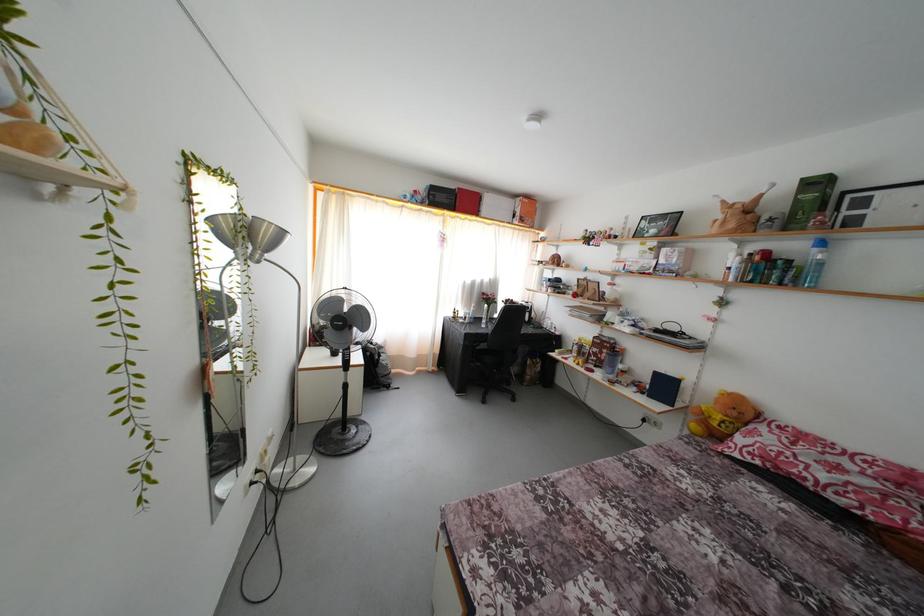
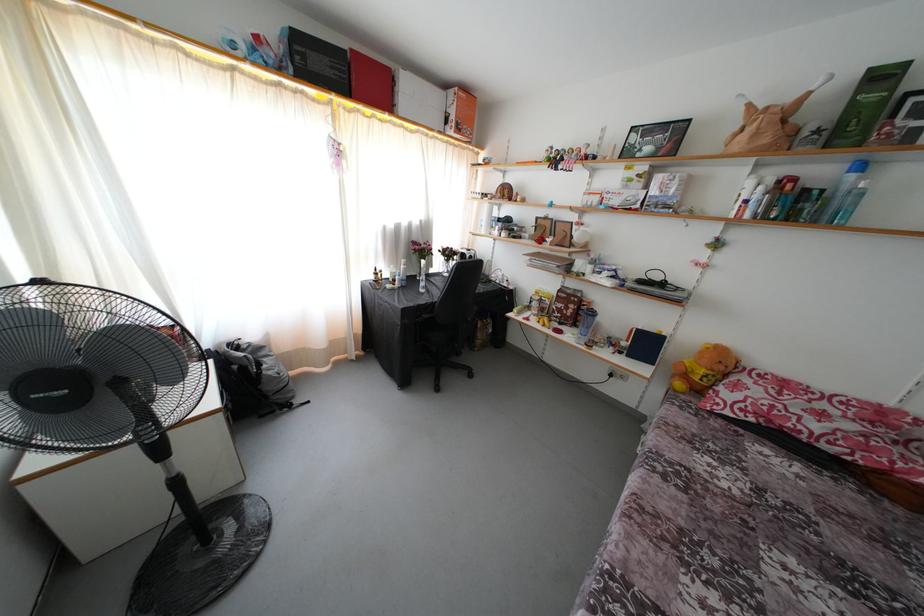
Locate, in the second image, the point that corresponds to the point at 775,438 in the first image.

(760, 389)